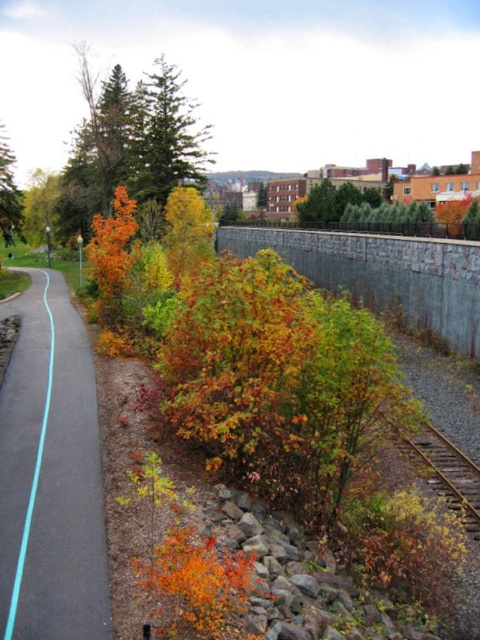
Question: Which is nearer to the green matte tree at upper center?

Choices:
 (A) blue asphalt path at center
 (B) orange leafy bush at left

Answer: (B)

Question: Which point is farther to the camera?

Choices:
 (A) (199, 134)
 (B) (0, 416)

Answer: (A)

Question: Which of the following is the closest to the observer?

Choices:
 (A) (32, 444)
 (B) (4, 221)
 (C) (210, 156)

Answer: (A)

Question: Is blue asphalt path at center behind orange leafy bush at left?

Choices:
 (A) no
 (B) yes

Answer: (A)

Question: Does blue asphalt path at center have a greater width compared to orange leafy bush at left?

Choices:
 (A) yes
 (B) no

Answer: (B)

Question: Does blue asphalt path at center lie in front of orange leafy bush at left?

Choices:
 (A) yes
 (B) no

Answer: (A)